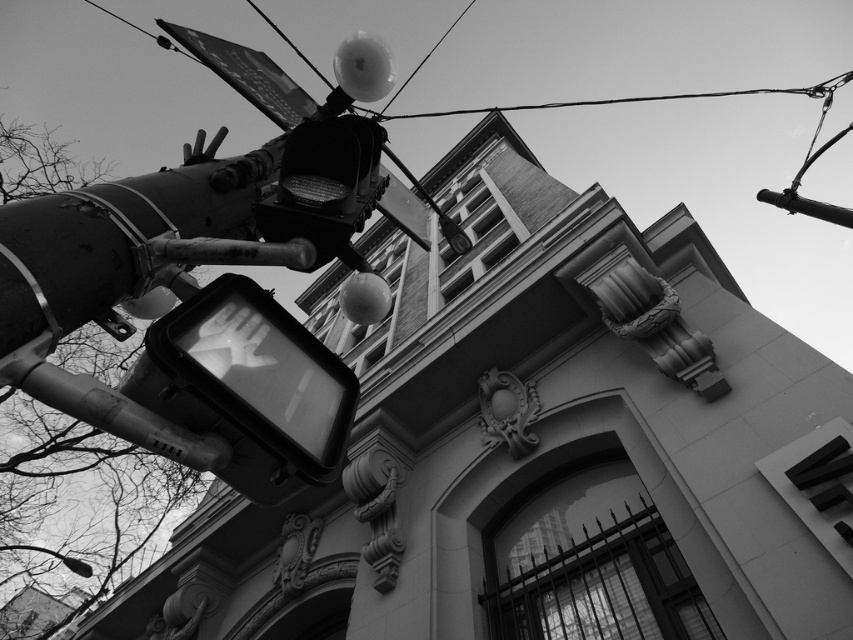
Question: Which object is positioned closest to the smooth metal pole at upper right?

Choices:
 (A) metallic reflective street sign at upper center
 (B) metallic traffic light at upper center

Answer: (B)

Question: Can you confirm if metallic traffic light at upper center is positioned above metallic wire at upper center?

Choices:
 (A) yes
 (B) no

Answer: (B)

Question: Which of the following is the closest to the observer?

Choices:
 (A) (372, 177)
 (B) (756, 196)

Answer: (A)

Question: Can you confirm if metallic rectangular traffic light at center-left is positioned to the right of metallic wire at upper center?

Choices:
 (A) yes
 (B) no

Answer: (A)

Question: Is metallic wire at upper center to the left of smooth metal pole at upper right from the viewer's perspective?

Choices:
 (A) yes
 (B) no

Answer: (A)

Question: Among these objects, which one is nearest to the camera?

Choices:
 (A) metallic rectangular traffic light at center-left
 (B) smooth metal pole at upper right
 (C) metallic reflective street sign at upper center

Answer: (A)